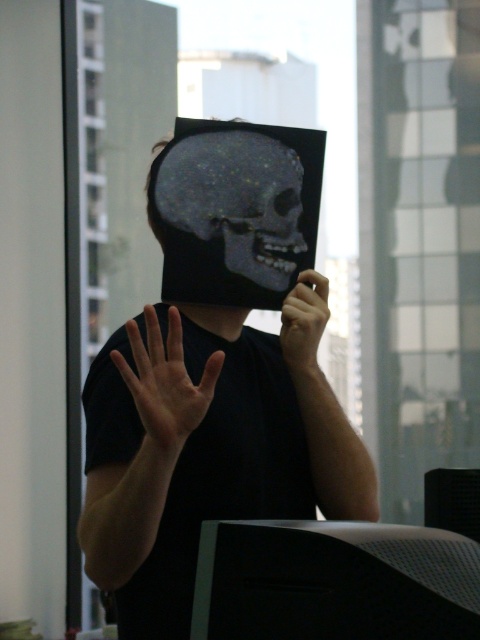
Does matte black skull at center appear on the right side of matte black monitor at center?

No, matte black skull at center is not to the right of matte black monitor at center.

In the scene shown: Which is more to the right, matte black skull at center or matte black monitor at center?

matte black monitor at center

The width and height of the screenshot is (480, 640). I want to click on matte black skull at center, so click(x=212, y=378).

Identify the location of matte black skull at center. The image size is (480, 640). (212, 378).

Who is lower down, gray matte skull at center or matte black hand at center?

matte black hand at center

Does gray matte skull at center have a greater height compared to matte black hand at center?

Yes, gray matte skull at center is taller than matte black hand at center.

This screenshot has width=480, height=640. Describe the element at coordinates (235, 214) in the screenshot. I see `gray matte skull at center` at that location.

Locate an element on the screen. gray matte skull at center is located at coordinates (235, 214).

What do you see at coordinates (334, 580) in the screenshot? This screenshot has width=480, height=640. I see `matte black monitor at center` at bounding box center [334, 580].

Between matte black monitor at center and matte black hand at center, which one has less height?

With less height is matte black monitor at center.

Describe the element at coordinates (334, 580) in the screenshot. I see `matte black monitor at center` at that location.

The image size is (480, 640). I want to click on matte black monitor at center, so click(x=334, y=580).